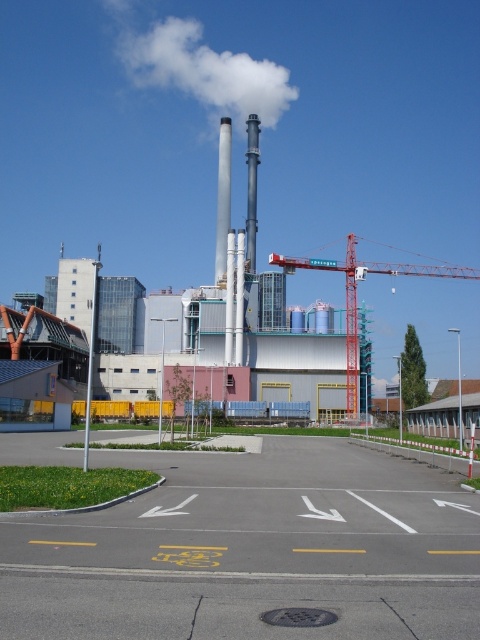
Does red metal crane at center have a greater width compared to smooth gray chimney at center?

Yes, red metal crane at center is wider than smooth gray chimney at center.

Looking at this image, is red metal crane at center above smooth gray chimney at center?

Incorrect, red metal crane at center is not positioned above smooth gray chimney at center.

Find the location of a particular element. The height and width of the screenshot is (640, 480). red metal crane at center is located at coordinates [x=356, y=296].

I want to click on red metal crane at center, so click(x=356, y=296).

Is white smoke at upper center taller than smooth gray chimney at center?

No.

Does point (244, 76) lie in front of point (250, 262)?

No, it is not.

Locate an element on the screen. white smoke at upper center is located at coordinates (201, 67).

Does white smooth chimney at center have a greater width compared to green grass at lower center?

Correct, the width of white smooth chimney at center exceeds that of green grass at lower center.

Is point (228, 198) farther from viewer compared to point (120, 445)?

Yes, it is.

Between point (228, 212) and point (163, 445), which one is positioned behind?

The point (228, 212) is behind.

Find the location of `white smooth chimney at center`. white smooth chimney at center is located at coordinates (223, 196).